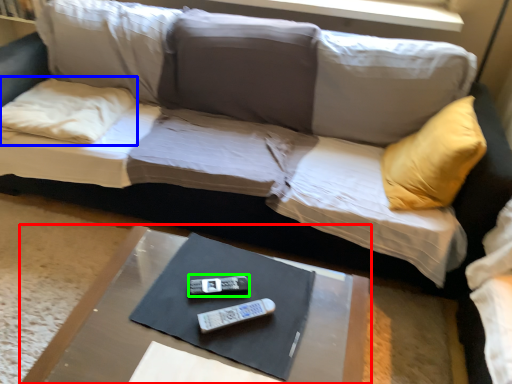
Question: Which object is the closest to the table (highlighted by a red box)? Choose among these: pillow (highlighted by a blue box) or remote (highlighted by a green box).

Choices:
 (A) pillow
 (B) remote

Answer: (B)